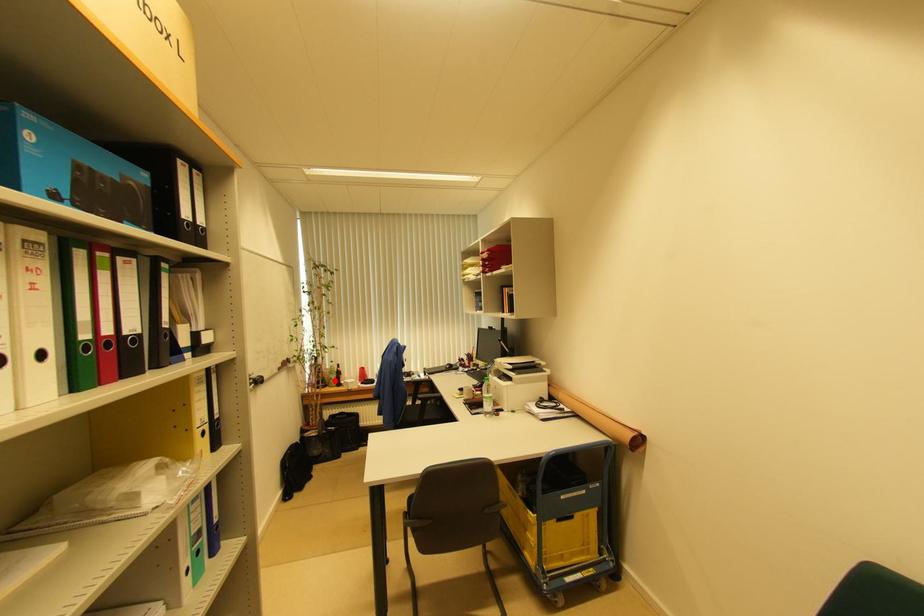
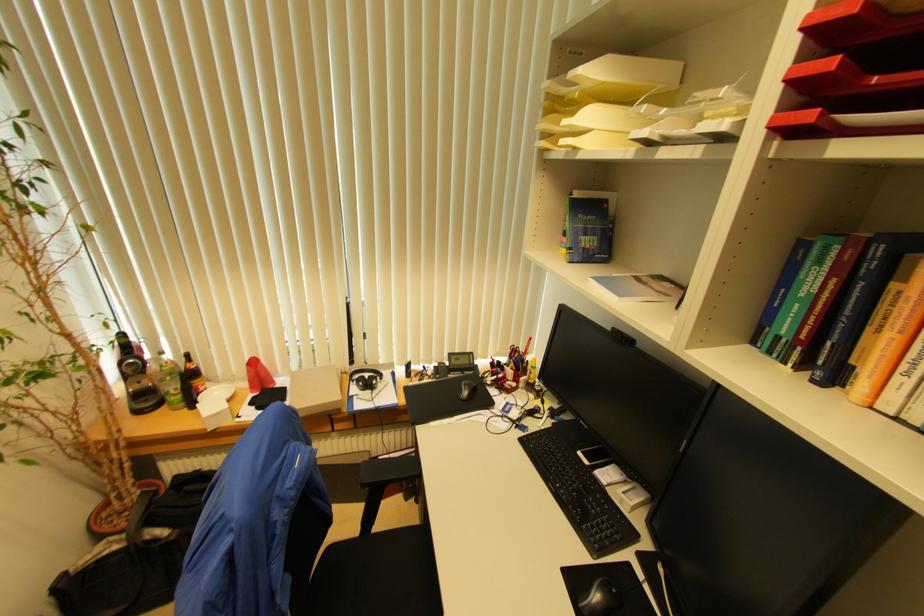
Find the pixel in the second image that matches the highlighted location in the first image.

(174, 394)